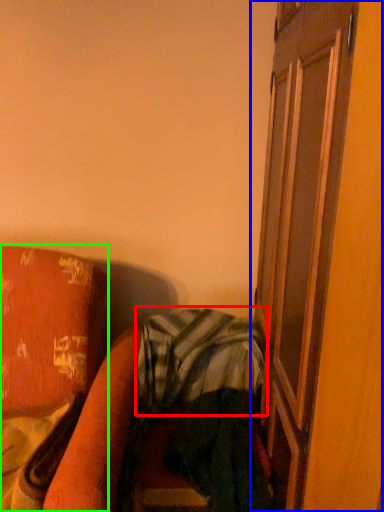
Question: Which is nearer to the plaid (highlighted by a red box)? screen door (highlighted by a blue box) or furniture (highlighted by a green box).

Choices:
 (A) screen door
 (B) furniture

Answer: (B)